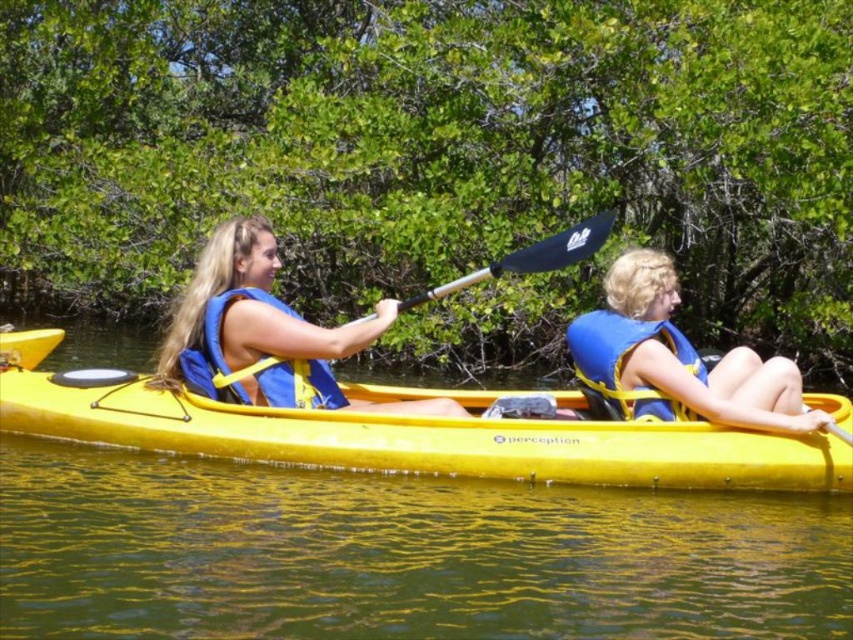
You are navigating a kayak on a calm lake surrounded by greenery. You see a yellow plastic canoe at center. Based on its position, can you estimate how far it is from the edge of the water body?

The yellow plastic canoe at center is located at point (416, 438), which suggests it is positioned closer to the center of the water body. Therefore, it is equidistant from all edges, making it approximately halfway between the edges.

You are a safety inspector checking the kayaking equipment. You notice the yellow plastic canoe at center and the blue life vest at right. According to safety regulations, the life vest must be easily accessible and not stored under the canoe. Is the current arrangement compliant?

The yellow plastic canoe at center is in front of the blue life vest at right, which means the life vest is not stored under the canoe. Therefore, the arrangement complies with safety regulations as the life vest is easily accessible.